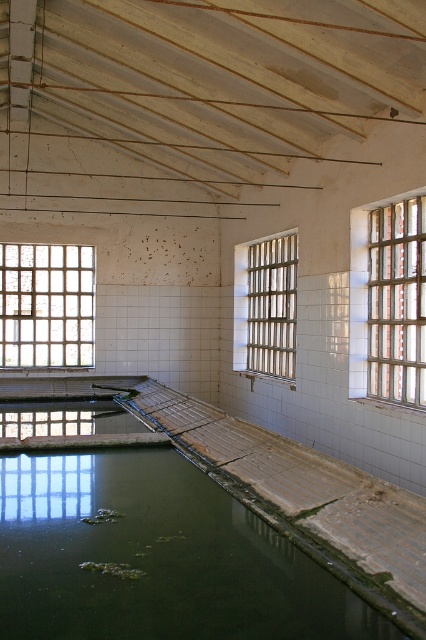
Question: Does clear glass window at right have a lesser width compared to clear glass window at left?

Choices:
 (A) no
 (B) yes

Answer: (B)

Question: Is green algae at lower left smaller than clear glass window at right?

Choices:
 (A) yes
 (B) no

Answer: (A)

Question: Which point is farther to the camera?

Choices:
 (A) metallic bars at center
 (B) clear glass window at left

Answer: (B)

Question: Considering the real-world distances, which object is farthest from the clear glass window at right?

Choices:
 (A) clear glass window at left
 (B) metallic bars at center

Answer: (A)

Question: Does green algae at lower left appear under clear glass window at left?

Choices:
 (A) no
 (B) yes

Answer: (B)

Question: Considering the real-world distances, which object is closest to the green algae at lower left?

Choices:
 (A) metallic bars at center
 (B) clear glass window at left

Answer: (A)